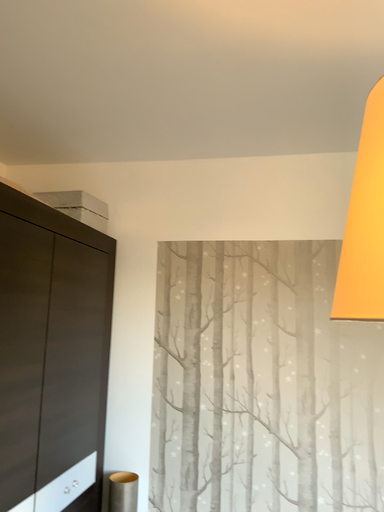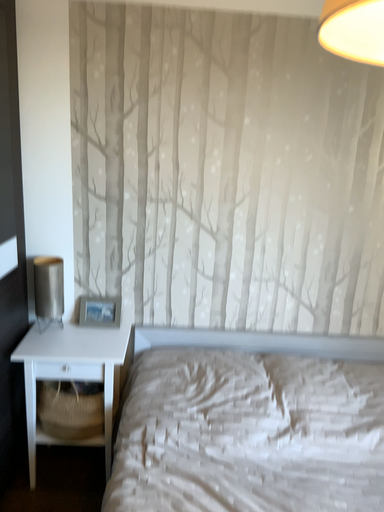
Question: How did the camera likely rotate when shooting the video?

Choices:
 (A) rotated upward
 (B) rotated downward

Answer: (B)